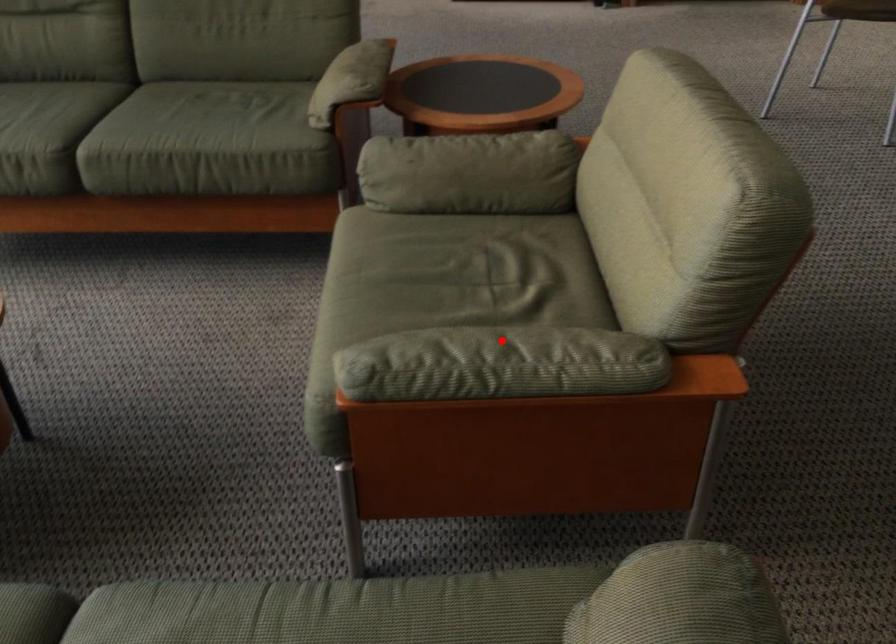
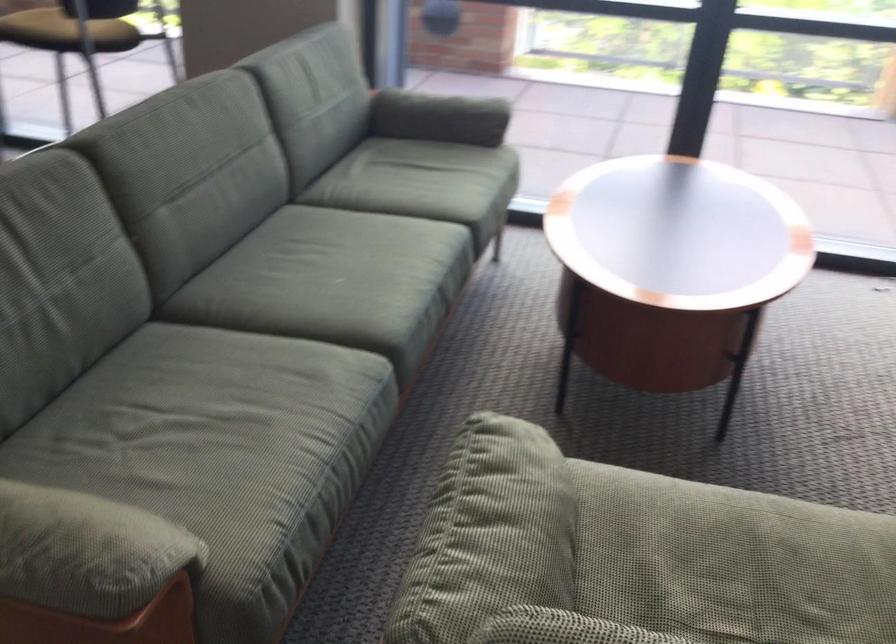
Question: I am providing you with two images of the same scene from different viewpoints. Image1 has a red point marked. In image2, the corresponding 3D location appears at what relative position? Reply with the corresponding letter.

Choices:
 (A) Closer
 (B) Farther

Answer: (A)